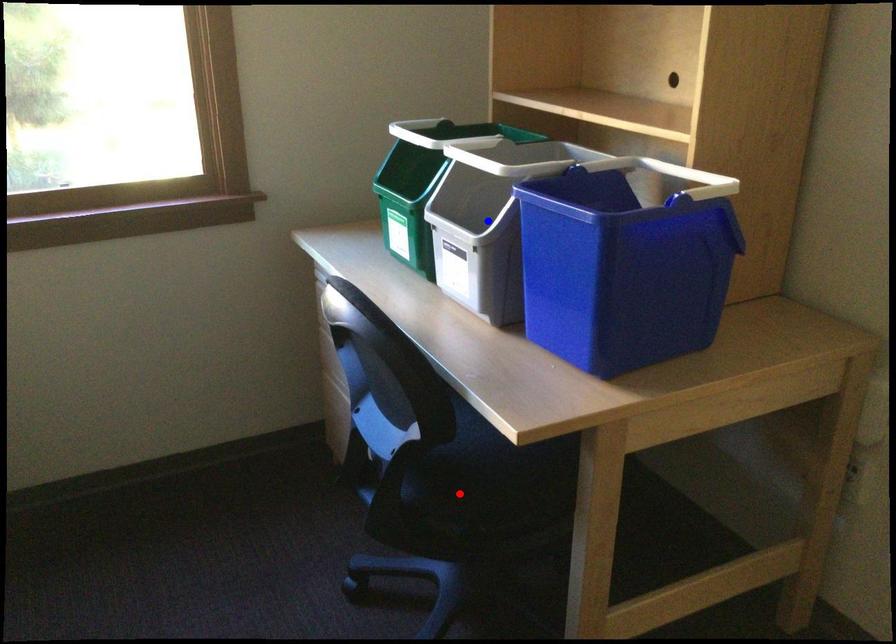
Question: In the image, two points are highlighted. Which point is nearer to the camera? Reply with the corresponding letter.

Choices:
 (A) blue point
 (B) red point

Answer: (B)